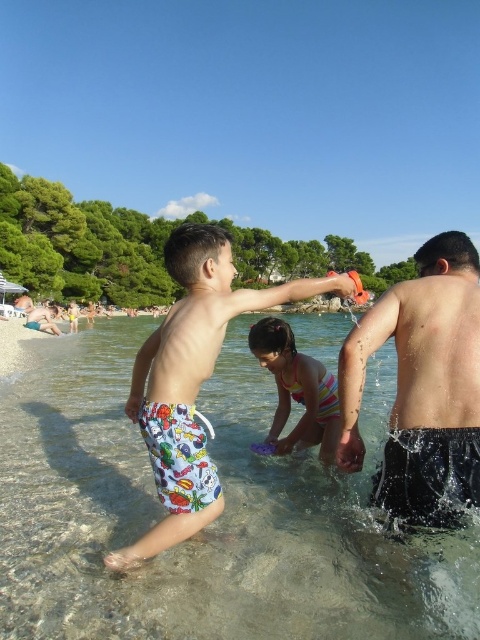
Question: Which of these objects is positioned closest to the dark gray shorts at right?

Choices:
 (A) clear water at center
 (B) printed swim trunks at center
 (C) striped swimsuit at center

Answer: (B)

Question: Is dark gray shorts at right positioned before striped swimsuit at center?

Choices:
 (A) no
 (B) yes

Answer: (B)

Question: Where is clear water at center located in relation to striped swimsuit at center in the image?

Choices:
 (A) right
 (B) left

Answer: (B)

Question: Is clear water at center wider than printed swim trunks at center?

Choices:
 (A) yes
 (B) no

Answer: (A)

Question: Which point is closer to the camera?

Choices:
 (A) [x=405, y=508]
 (B) [x=72, y=404]
 (C) [x=222, y=275]

Answer: (A)

Question: Which point is closer to the camera taking this photo?

Choices:
 (A) (421, 518)
 (B) (316, 417)
 (C) (275, 554)
 (D) (153, 412)

Answer: (A)